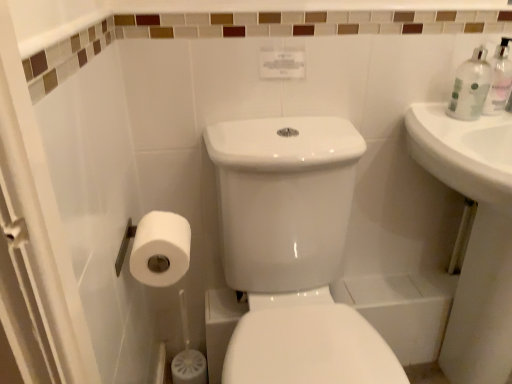
The width and height of the screenshot is (512, 384). What do you see at coordinates (161, 249) in the screenshot?
I see `white matte toilet paper at lower left` at bounding box center [161, 249].

Where is `clear plastic bottle at upper right`? The width and height of the screenshot is (512, 384). clear plastic bottle at upper right is located at coordinates (499, 79).

Between white glossy sink at right and clear plastic bottle at upper right, which one appears on the right side from the viewer's perspective?

clear plastic bottle at upper right is more to the right.

This screenshot has width=512, height=384. In the image, there is a clear plastic bottle at upper right. In order to click on counter top below it (from a real-world perspective) in this screenshot , I will do `click(474, 236)`.

Looking at this image, from the image's perspective, relative to clear plastic bottle at upper right, is white glossy sink at right above or below?

Clearly, from the image's perspective, white glossy sink at right is below clear plastic bottle at upper right.

Where is `toilet paper above the white glossy sink at right (from the image's perspective)`? This screenshot has height=384, width=512. toilet paper above the white glossy sink at right (from the image's perspective) is located at coordinates (161, 249).

Between white matte toilet paper at lower left and white glossy sink at right, which one has larger width?

white glossy sink at right is wider.

Which point is more distant from viewer, (x=143, y=275) or (x=473, y=365)?

The point (x=473, y=365) is more distant.

Is white glossy sink at right facing away from clear plastic bottle at upper right?

No, white glossy sink at right is not facing away from clear plastic bottle at upper right.

Could clear plastic bottle at upper right be considered to be inside white glossy sink at right?

No, clear plastic bottle at upper right is not surrounded by white glossy sink at right.

Find the location of a particular element. The height and width of the screenshot is (384, 512). toiletry behind the white glossy sink at right is located at coordinates (470, 87).

Is white matte toilet paper at lower left aimed at white glossy porcelain at center?

Yes.

Where is `porcelain on the right of white matte toilet paper at lower left`? This screenshot has width=512, height=384. porcelain on the right of white matte toilet paper at lower left is located at coordinates (292, 252).

Is white matte toilet paper at lower left with white glossy porcelain at center?

There is a gap between white matte toilet paper at lower left and white glossy porcelain at center.

Looking at their sizes, would you say clear plastic bottle at upper right is wider or thinner than white glossy porcelain at center?

Clearly, clear plastic bottle at upper right has less width compared to white glossy porcelain at center.

Is clear plastic bottle at upper right looking in the opposite direction of white glossy porcelain at center?

That's not correct — clear plastic bottle at upper right is not looking away from white glossy porcelain at center.

This screenshot has width=512, height=384. In order to click on soap dispenser above the white glossy porcelain at center (from the image's perspective) in this screenshot , I will do `click(499, 79)`.

Is white glossy porcelain at center located within clear plastic bottle at upper right?

No, clear plastic bottle at upper right does not contain white glossy porcelain at center.

Considering the sizes of objects clear plastic bottle at upper right and white glossy sink at right in the image provided, who is taller, clear plastic bottle at upper right or white glossy sink at right?

white glossy sink at right is taller.

Is clear plastic bottle at upper right oriented towards white glossy sink at right?

No, clear plastic bottle at upper right is not facing towards white glossy sink at right.

Which object is positioned more to the right, clear plastic bottle at upper right or white glossy sink at right?

Positioned to the right is white glossy sink at right.

Considering the positions of points (465, 105) and (482, 277), is point (465, 105) farther from camera compared to point (482, 277)?

That is False.

Is point (375, 334) in front of point (490, 87)?

Yes, point (375, 334) is closer to viewer.

Would you say white glossy porcelain at center is to the left or to the right of clear plastic bottle at upper right in the picture?

Clearly, white glossy porcelain at center is on the left of clear plastic bottle at upper right in the image.

Considering the relative sizes of white glossy porcelain at center and clear plastic bottle at upper right in the image provided, is white glossy porcelain at center taller than clear plastic bottle at upper right?

Indeed, white glossy porcelain at center has a greater height compared to clear plastic bottle at upper right.

In the image, there is a white glossy porcelain at center. Where is `soap dispenser above it (from the image's perspective)`? soap dispenser above it (from the image's perspective) is located at coordinates (499, 79).

I want to click on soap dispenser that appears on the right of white glossy sink at right, so click(x=499, y=79).

The width and height of the screenshot is (512, 384). Find the location of `toilet paper that appears above the white glossy sink at right (from a real-world perspective)`. toilet paper that appears above the white glossy sink at right (from a real-world perspective) is located at coordinates (161, 249).

Estimate the real-world distances between objects in this image. Which object is closer to clear plastic bottle at upper right, white glossy sink at right or white glossy porcelain at center?

white glossy sink at right is closer to clear plastic bottle at upper right.

Which object lies further to the anchor point white glossy porcelain at center, white glossy sink at right or white matte toilet paper at lower left?

white glossy sink at right lies further to white glossy porcelain at center than the other object.

From the picture: From the image, which object appears to be farther from white glossy sink at right, clear plastic bottle at upper right or white matte toilet paper at lower left?

Based on the image, white matte toilet paper at lower left appears to be further to white glossy sink at right.

Based on their spatial positions, is clear plastic bottle at upper right or white matte toilet paper at lower left further from clear plastic bottle at upper right?

white matte toilet paper at lower left is positioned further to the anchor clear plastic bottle at upper right.

When comparing their distances from clear plastic bottle at upper right, does white glossy porcelain at center or white matte toilet paper at lower left seem closer?

The object closer to clear plastic bottle at upper right is white glossy porcelain at center.

From the image, which object appears to be farther from clear plastic bottle at upper right, white glossy sink at right or clear plastic bottle at upper right?

white glossy sink at right is positioned further to the anchor clear plastic bottle at upper right.

Considering their positions, is white glossy porcelain at center positioned further to clear plastic bottle at upper right than clear plastic bottle at upper right?

white glossy porcelain at center is positioned further to the anchor clear plastic bottle at upper right.

Considering their positions, is clear plastic bottle at upper right positioned closer to clear plastic bottle at upper right than white glossy sink at right?

clear plastic bottle at upper right is closer to clear plastic bottle at upper right.

At what (x,y) coordinates should I click in order to perform the action: click on porcelain between white matte toilet paper at lower left and clear plastic bottle at upper right in the horizontal direction. Please return your answer as a coordinate pair (x, y). Image resolution: width=512 pixels, height=384 pixels. Looking at the image, I should click on (292, 252).

Image resolution: width=512 pixels, height=384 pixels. What are the coordinates of `porcelain between white matte toilet paper at lower left and white glossy sink at right in the horizontal direction` in the screenshot? It's located at (292, 252).

I want to click on counter top between white matte toilet paper at lower left and clear plastic bottle at upper right from left to right, so click(x=474, y=236).

Image resolution: width=512 pixels, height=384 pixels. I want to click on soap dispenser between clear plastic bottle at upper right and white glossy porcelain at center in the up-down direction, so click(x=499, y=79).